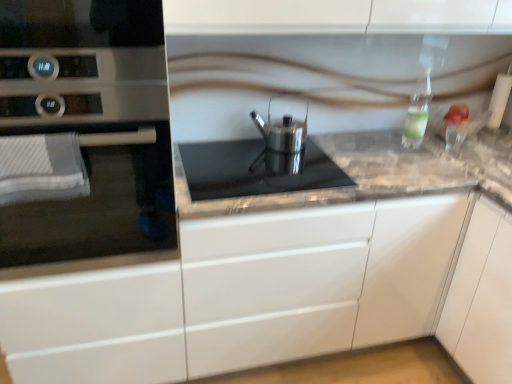
Question: Is clear glass bottle at upper right bigger or smaller than satin silver cookware at center?

Choices:
 (A) small
 (B) big

Answer: (A)

Question: Considering the positions of clear glass bottle at upper right and satin silver cookware at center in the image, is clear glass bottle at upper right taller or shorter than satin silver cookware at center?

Choices:
 (A) tall
 (B) short

Answer: (A)

Question: Which of these objects is positioned closest to the clear glass bottle at upper right?

Choices:
 (A) marble gray counter at center
 (B) satin silver oven at left
 (C) satin silver kettle at center
 (D) satin silver cookware at center

Answer: (C)

Question: Which object is the closest to the marble gray counter at center?

Choices:
 (A) satin silver oven at left
 (B) satin silver cookware at center
 (C) satin silver kettle at center
 (D) clear glass bottle at upper right

Answer: (B)